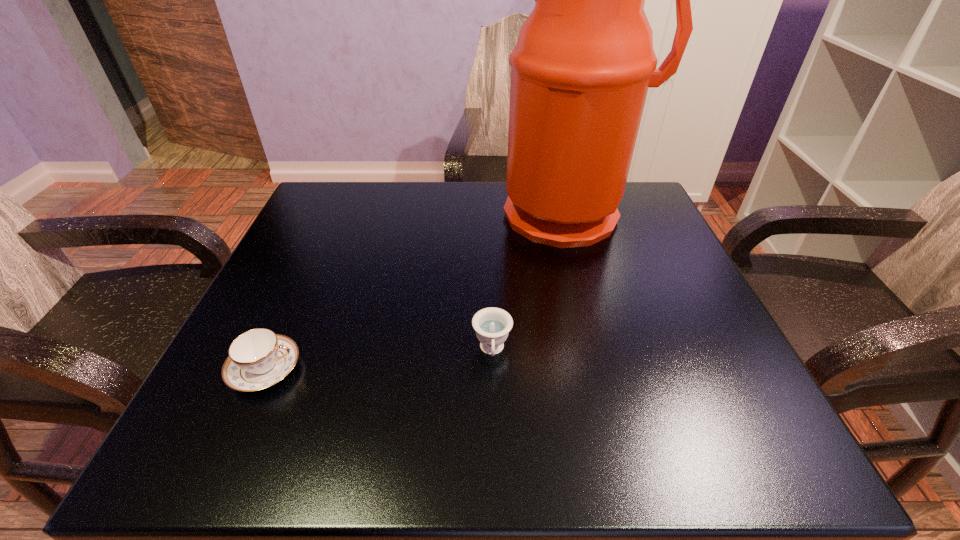
Image resolution: width=960 pixels, height=540 pixels. I want to click on vacant space that's between the tallest object and the left teacup, so click(x=418, y=292).

Image resolution: width=960 pixels, height=540 pixels. I want to click on free space between the right teacup and the tallest object, so click(x=531, y=282).

Locate an element on the screen. The width and height of the screenshot is (960, 540). blank region between the right teacup and the left teacup is located at coordinates (378, 360).

Find the location of a particular element. The image size is (960, 540). free area in between the right teacup and the farthest object is located at coordinates (531, 282).

Locate an element on the screen. free space that is in between the tallest object and the left teacup is located at coordinates (418, 292).

Image resolution: width=960 pixels, height=540 pixels. Find the location of `free space between the water jug and the leftmost object`. free space between the water jug and the leftmost object is located at coordinates (418, 292).

Locate an element on the screen. vacant space that's between the leftmost object and the water jug is located at coordinates (418, 292).

Locate an element on the screen. The height and width of the screenshot is (540, 960). empty location between the left teacup and the farthest object is located at coordinates (418, 292).

The height and width of the screenshot is (540, 960). What are the coordinates of `object identified as the second closest to the farthest object` in the screenshot? It's located at (259, 358).

Where is `the second closest object to the left teacup`? the second closest object to the left teacup is located at coordinates (584, 60).